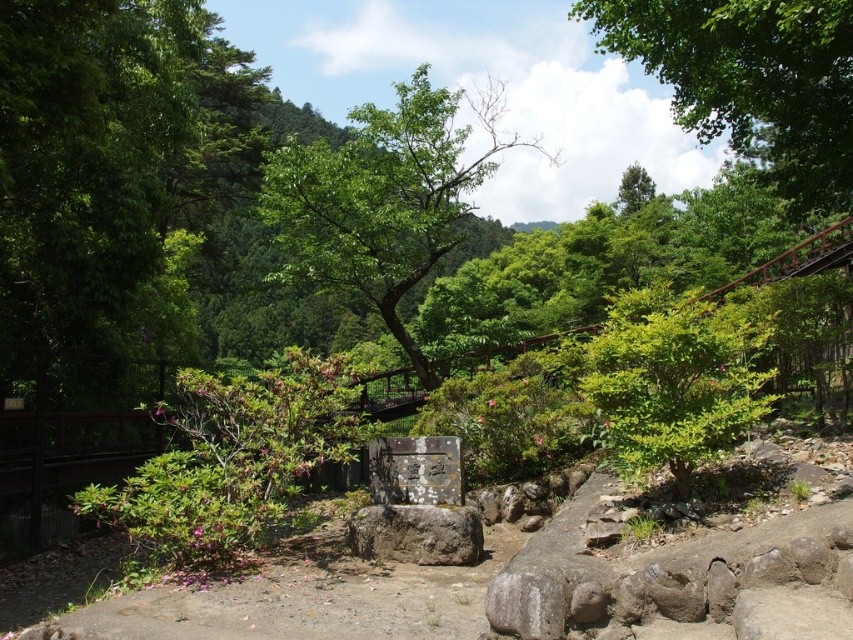
Question: Does green leafy tree at center come behind gray stone boulder at center?

Choices:
 (A) no
 (B) yes

Answer: (B)

Question: Is green leafy bush at center below gray stone boulder at center?

Choices:
 (A) no
 (B) yes

Answer: (A)

Question: Is green leafy tree at center bigger than green leafy tree at upper center?

Choices:
 (A) no
 (B) yes

Answer: (A)

Question: Among these objects, which one is farthest from the camera?

Choices:
 (A) gray stone boulder at center
 (B) green leafy bush at center
 (C) green leafy tree at center
 (D) green leafy tree at upper center

Answer: (C)

Question: Considering the real-world distances, which object is farthest from the green leafy tree at upper center?

Choices:
 (A) green leafy bush at center
 (B) green leafy tree at center
 (C) gray stone boulder at center

Answer: (B)

Question: Estimate the real-world distances between objects in this image. Which object is farther from the gray stone boulder at center?

Choices:
 (A) green leafy bush at center
 (B) green leafy tree at upper center
 (C) green leafy tree at center

Answer: (C)